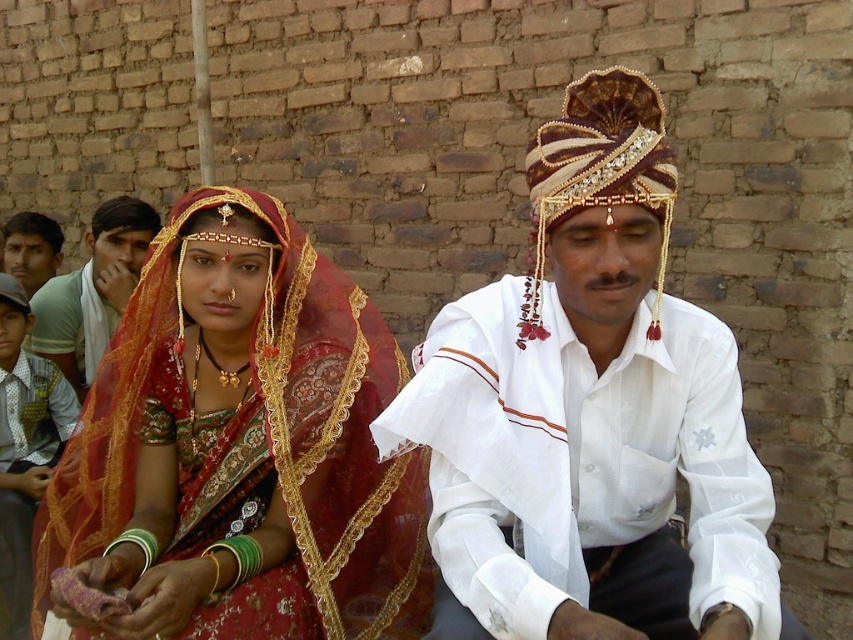
Which of these two, white embroidered shirt at center or matte gold necklace at center, stands taller?

Standing taller between the two is white embroidered shirt at center.

Is point (512, 353) closer to camera compared to point (96, 257)?

That is True.

Between point (471, 372) and point (80, 316), which one is positioned behind?

Point (80, 316)

Where is `white embroidered shirt at center`? The image size is (853, 640). white embroidered shirt at center is located at coordinates (590, 413).

You are a GUI agent. You are given a task and a screenshot of the screen. Output one action in this format:
    pyautogui.click(x=<x>, y=<y>)
    Task: Click on the white embroidered shirt at center
    Image resolution: width=853 pixels, height=640 pixels.
    Given the screenshot: What is the action you would take?
    pyautogui.click(x=590, y=413)

Can you confirm if white embroidered shirt at center is bigger than matte red saree at center?

Incorrect, white embroidered shirt at center is not larger than matte red saree at center.

Is point (612, 595) positioned before point (161, 600)?

No.

The height and width of the screenshot is (640, 853). In order to click on white embroidered shirt at center in this screenshot , I will do `click(590, 413)`.

Does white embroidered shirt at center have a lesser height compared to beaded silk turban at upper right?

No, white embroidered shirt at center is not shorter than beaded silk turban at upper right.

Does white embroidered shirt at center appear over beaded silk turban at upper right?

Incorrect, white embroidered shirt at center is not positioned above beaded silk turban at upper right.

Does point (589, 589) come behind point (645, 90)?

Yes, point (589, 589) is behind point (645, 90).

This screenshot has width=853, height=640. What are the coordinates of `white embroidered shirt at center` in the screenshot? It's located at (590, 413).